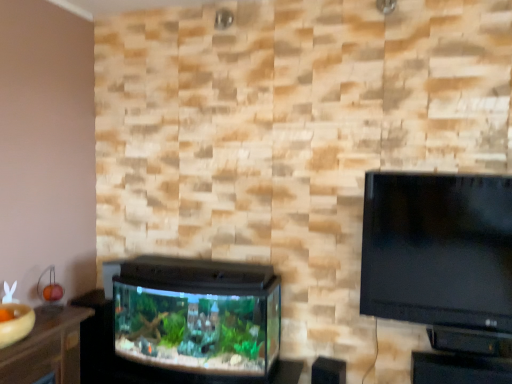
Question: Is wooden table at lower left outside black plastic table at lower right?

Choices:
 (A) no
 (B) yes

Answer: (B)

Question: Is wooden table at lower left at the left side of black plastic table at lower right?

Choices:
 (A) no
 (B) yes

Answer: (B)

Question: Considering the relative sizes of wooden table at lower left and black plastic table at lower right in the image provided, is wooden table at lower left smaller than black plastic table at lower right?

Choices:
 (A) no
 (B) yes

Answer: (B)

Question: Does wooden table at lower left have a greater height compared to black plastic table at lower right?

Choices:
 (A) yes
 (B) no

Answer: (B)

Question: Does wooden table at lower left have a larger size compared to black plastic table at lower right?

Choices:
 (A) no
 (B) yes

Answer: (A)

Question: Is the position of wooden table at lower left less distant than that of black plastic table at lower right?

Choices:
 (A) yes
 (B) no

Answer: (A)

Question: From a real-world perspective, is wooden table at lower left under black plastic aquarium at lower left?

Choices:
 (A) no
 (B) yes

Answer: (A)

Question: Is black plastic aquarium at lower left inside wooden table at lower left?

Choices:
 (A) yes
 (B) no

Answer: (B)

Question: Is wooden table at lower left located outside black plastic aquarium at lower left?

Choices:
 (A) no
 (B) yes

Answer: (B)

Question: Can you confirm if wooden table at lower left is smaller than black plastic aquarium at lower left?

Choices:
 (A) no
 (B) yes

Answer: (B)

Question: From a real-world perspective, is wooden table at lower left physically above black plastic aquarium at lower left?

Choices:
 (A) yes
 (B) no

Answer: (A)

Question: From the image's perspective, does wooden table at lower left appear higher than black plastic aquarium at lower left?

Choices:
 (A) no
 (B) yes

Answer: (A)

Question: Considering the relative sizes of black plastic table at lower right and wooden table at lower left in the image provided, is black plastic table at lower right bigger than wooden table at lower left?

Choices:
 (A) yes
 (B) no

Answer: (A)